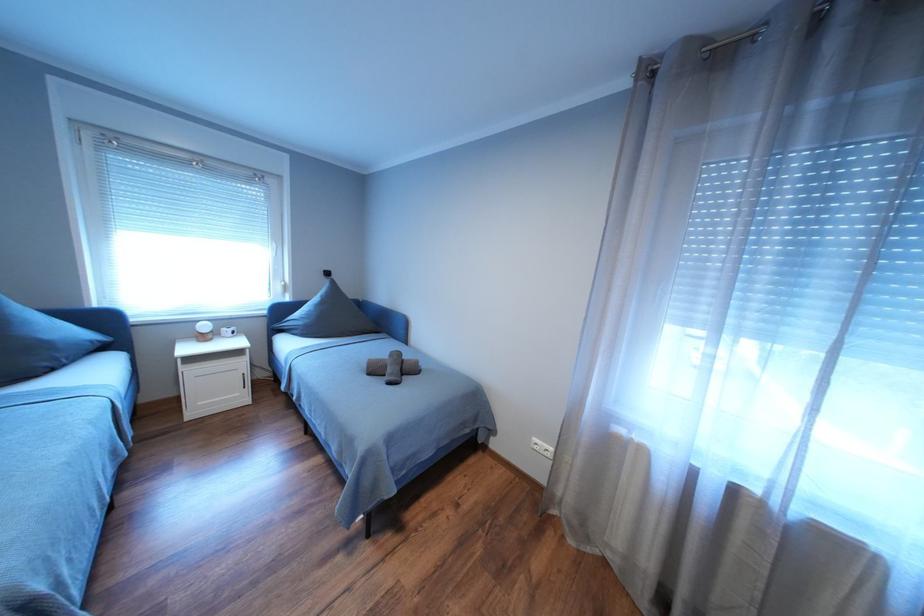
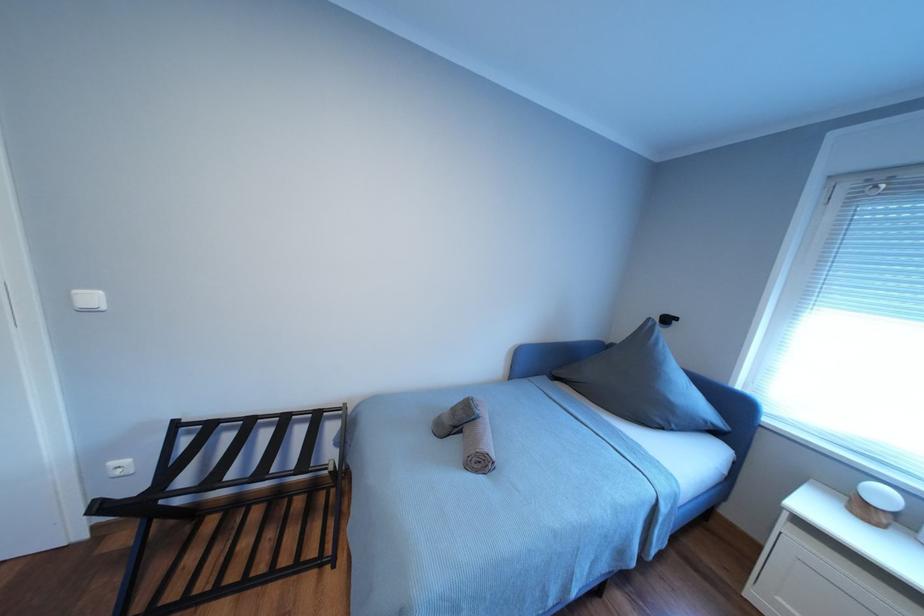
Question: Based on the continuous images, in which direction is the camera rotating? Reply with the corresponding letter.

Choices:
 (A) Left
 (B) Right
 (C) Up
 (D) Down

Answer: (A)